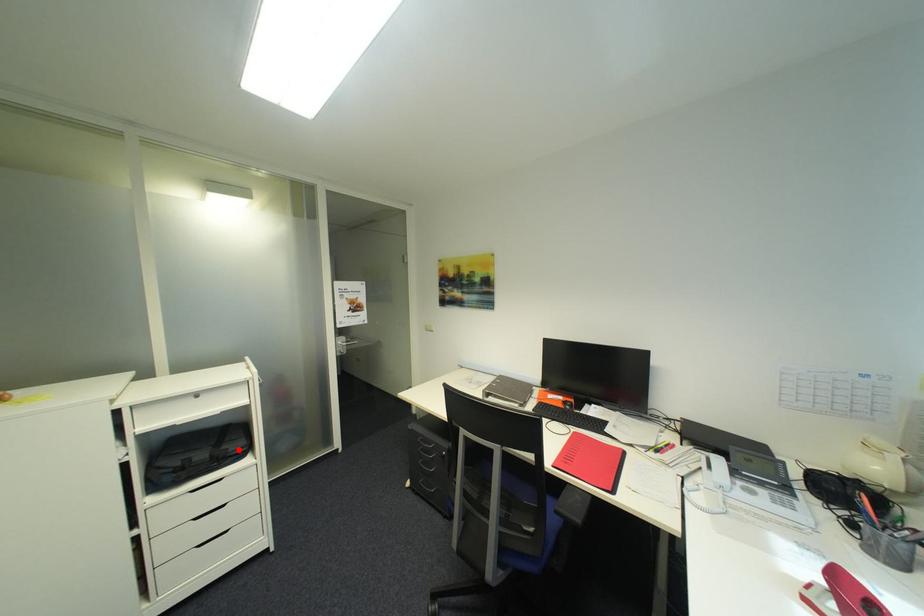
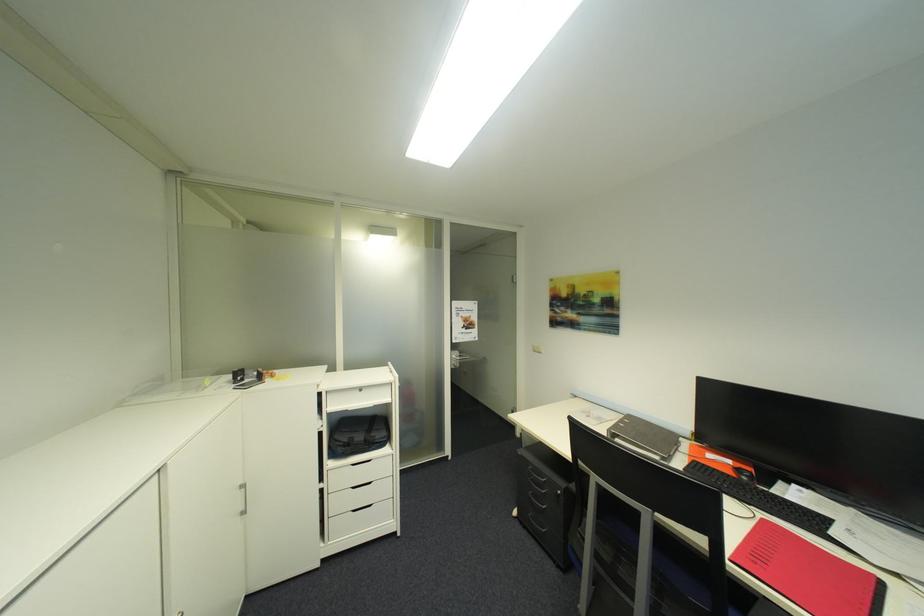
Question: I am providing you with two images of the same scene from different viewpoints. Given a red point in image1, look at the same physical point in image2. Is it:

Choices:
 (A) Closer to the viewpoint
 (B) Farther from the viewpoint

Answer: (B)